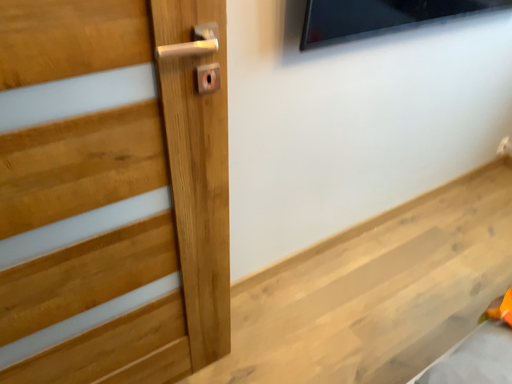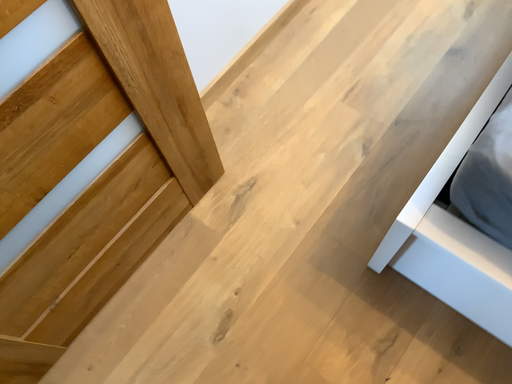
Question: Which way did the camera rotate in the video?

Choices:
 (A) rotated downward
 (B) rotated upward

Answer: (A)